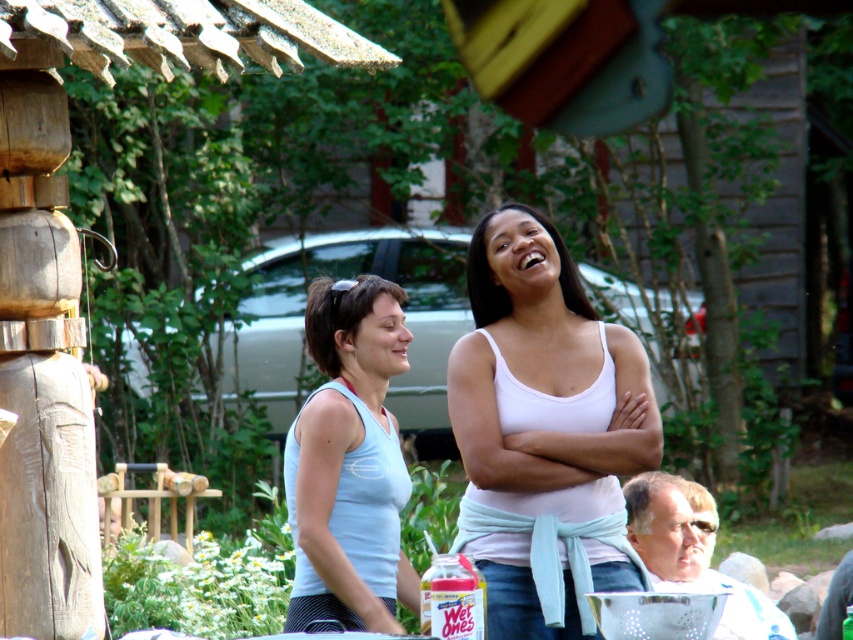
You are planning to wear a tank top to a casual gathering and have both the white matte tank top at center and the light blue fabric tank top at center available. Based on the image, which tank top would you choose if you want a wider option?

The white matte tank top at center has a larger width than the light blue fabric tank top at center, so it would be the better choice for a wider option.

You are a photographer trying to capture a closeup shot of both the white matte tank top at center and the light blue fabric tank top at center. Given that your camera lens has a maximum focus range of 25 inches, will you be able to focus on both subjects simultaneously?

The white matte tank top at center and light blue fabric tank top at center are 27.44 inches apart from each other. Since the distance between them exceeds the camera lens maximum focus range of 25 inches, you will not be able to focus on both subjects simultaneously.